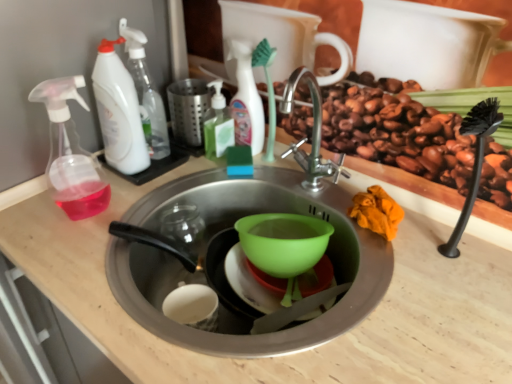
Question: Is transparent plastic spray bottle at left smaller than light wood counter top at center?

Choices:
 (A) no
 (B) yes

Answer: (B)

Question: Can you confirm if transparent plastic spray bottle at left is positioned to the left of light wood counter top at center?

Choices:
 (A) no
 (B) yes

Answer: (B)

Question: Considering the relative positions of transparent plastic spray bottle at left and light wood counter top at center in the image provided, is transparent plastic spray bottle at left behind light wood counter top at center?

Choices:
 (A) yes
 (B) no

Answer: (A)

Question: From a real-world perspective, is transparent plastic spray bottle at left over light wood counter top at center?

Choices:
 (A) yes
 (B) no

Answer: (A)

Question: From a real-world perspective, is transparent plastic spray bottle at left below light wood counter top at center?

Choices:
 (A) yes
 (B) no

Answer: (B)

Question: Is point (74, 210) closer or farther from the camera than point (159, 100)?

Choices:
 (A) farther
 (B) closer

Answer: (B)

Question: Is transparent plastic spray bottle at left in front of or behind white plastic spray bottle at upper left, placed as the 3th cleaning product when sorted from right to left, in the image?

Choices:
 (A) behind
 (B) front

Answer: (B)

Question: Would you say transparent plastic spray bottle at left is inside or outside white plastic spray bottle at upper left, placed as the 3th cleaning product when sorted from right to left?

Choices:
 (A) outside
 (B) inside

Answer: (A)

Question: Is transparent plastic spray bottle at left wider or thinner than white plastic spray bottle at upper left, placed as the 3th cleaning product when sorted from right to left?

Choices:
 (A) wide
 (B) thin

Answer: (A)

Question: Is green liquid soap at upper center, acting as the 3th cleaning product starting from the left, inside the boundaries of white matte bottle at upper center, arranged as the fourth cleaning product when viewed from the left, or outside?

Choices:
 (A) outside
 (B) inside

Answer: (A)

Question: Considering the positions of point (211, 102) and point (245, 72), is point (211, 102) closer or farther from the camera than point (245, 72)?

Choices:
 (A) closer
 (B) farther

Answer: (B)

Question: From the image's perspective, is green liquid soap at upper center, acting as the 3th cleaning product starting from the left, located above or below white matte bottle at upper center, the first cleaning product from the right?

Choices:
 (A) above
 (B) below

Answer: (B)

Question: From a real-world perspective, is green liquid soap at upper center, positioned as the second cleaning product in right-to-left order, positioned above or below white matte bottle at upper center, arranged as the fourth cleaning product when viewed from the left?

Choices:
 (A) below
 (B) above

Answer: (A)

Question: Considering the positions of point (395, 352) and point (212, 155), is point (395, 352) closer or farther from the camera than point (212, 155)?

Choices:
 (A) farther
 (B) closer

Answer: (B)

Question: From the image's perspective, is light wood counter top at center located above or below green liquid soap at upper center, positioned as the second cleaning product in right-to-left order?

Choices:
 (A) above
 (B) below

Answer: (B)